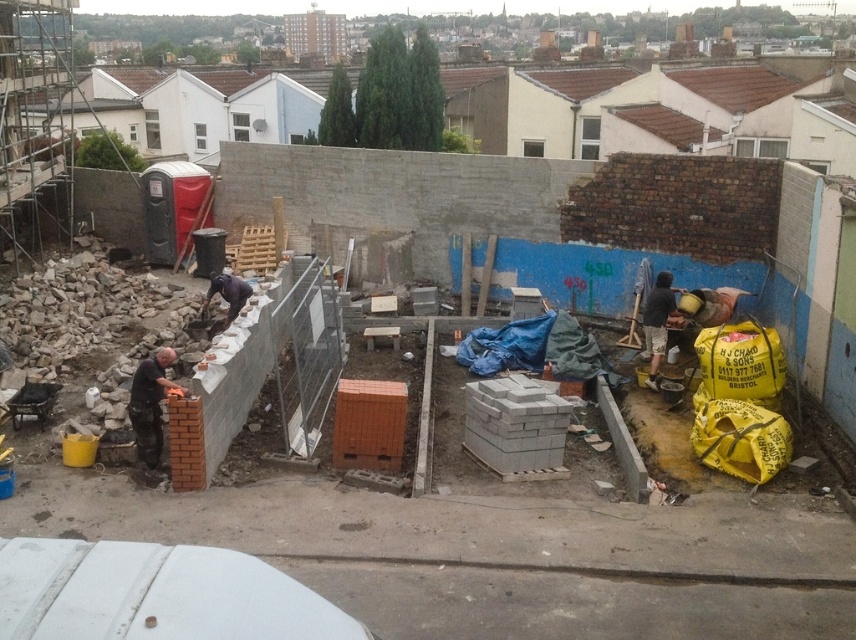
Does matte black t-shirt at left appear under dark gray fabric shirt at right?

Correct, matte black t-shirt at left is located below dark gray fabric shirt at right.

Who is more distant from viewer, (150,397) or (663,323)?

Positioned behind is point (663,323).

This screenshot has width=856, height=640. Describe the element at coordinates (150, 404) in the screenshot. I see `matte black t-shirt at left` at that location.

Identify the location of matte black t-shirt at left. (150, 404).

Between matte black t-shirt at left and dark brown leather jacket at center, which one has more height?

matte black t-shirt at left is taller.

What do you see at coordinates (150, 404) in the screenshot? I see `matte black t-shirt at left` at bounding box center [150, 404].

Is point (146, 384) positioned after point (235, 280)?

That is False.

Image resolution: width=856 pixels, height=640 pixels. Find the location of `matte black t-shirt at left`. matte black t-shirt at left is located at coordinates (150, 404).

Between dark gray fabric shirt at right and dark brown leather jacket at center, which one appears on the left side from the viewer's perspective?

dark brown leather jacket at center is more to the left.

Can you confirm if dark gray fabric shirt at right is positioned to the right of dark brown leather jacket at center?

Yes, dark gray fabric shirt at right is to the right of dark brown leather jacket at center.

The width and height of the screenshot is (856, 640). Find the location of `dark gray fabric shirt at right`. dark gray fabric shirt at right is located at coordinates (657, 323).

I want to click on dark gray fabric shirt at right, so click(x=657, y=323).